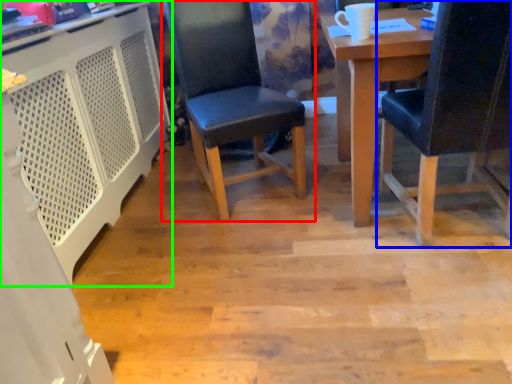
Question: Considering the real-world distances, which object is farthest from chair (highlighted by a red box)? chair (highlighted by a blue box) or computer desk (highlighted by a green box)?

Choices:
 (A) chair
 (B) computer desk

Answer: (A)